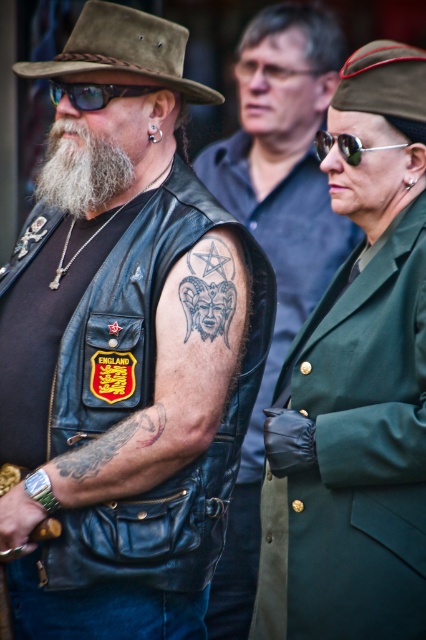
Question: Which object is positioned closest to the brown suede fedora at upper left?

Choices:
 (A) leather tattoo at center
 (B) leather vest at left

Answer: (A)

Question: Is graywool-likebeard at left positioned at the back of sunglasses at center?

Choices:
 (A) yes
 (B) no

Answer: (A)

Question: Which point is closer to the camera taking this photo?

Choices:
 (A) (155, 422)
 (B) (325, 138)
 (C) (172, 522)

Answer: (A)

Question: Does leather vest at center lie behind leather vest at left?

Choices:
 (A) yes
 (B) no

Answer: (B)

Question: Does leather vest at left appear under brown suede fedora at upper left?

Choices:
 (A) no
 (B) yes

Answer: (B)

Question: Among these objects, which one is farthest from the camera?

Choices:
 (A) leather vest at center
 (B) graywool-likebeard at left

Answer: (B)